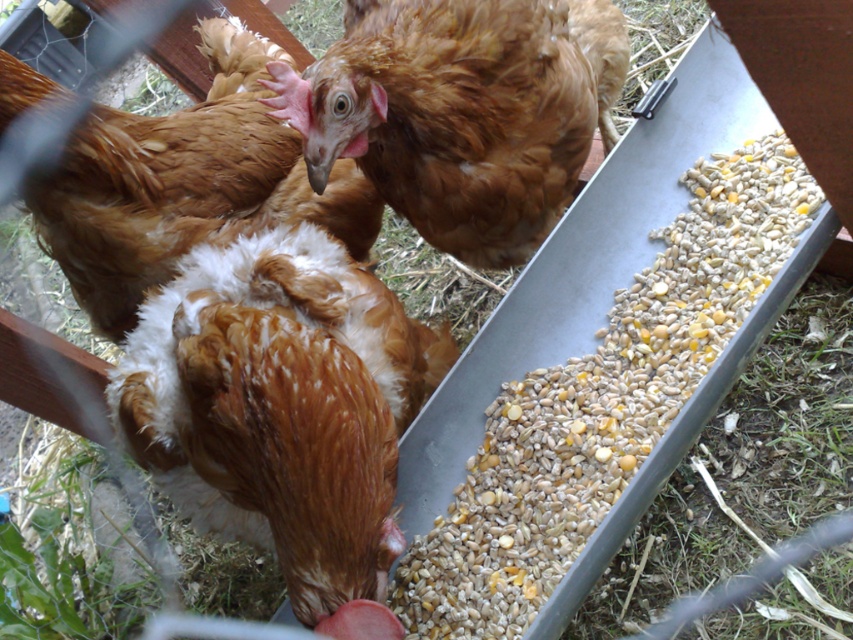
You are standing in a farm area and want to reach a point that is 1.33 meters away from you. If you move towards the point marked at coordinate point [323,492], will you be able to reach it within 2 steps?

The distance between you and the point marked at coordinate point [323,492] is 1.33 meters. Assuming an average step length of about 0.75 meters, two steps would cover approximately 1.5 meters, which is slightly more than the required distance. Therefore, yes, you can reach the point within 2 steps.

You are a farmer checking the health of your chickens. You notice two chickens at the center of the trough. Which chicken has a shorter height between the brown speckled feathers at center and the brown fluffy chicken at center?

The brown speckled feathers at center is shorter than the brown fluffy chicken at center.

You are a farmer checking the feeding area for chickens. You notice a specific point marked at coordinates (282, 410) in the image. Based on the scene description, what does this point likely represent?

The point at (282, 410) likely represents the brown speckled feathers at center, indicating the location of the chicken actively feeding from the trough.